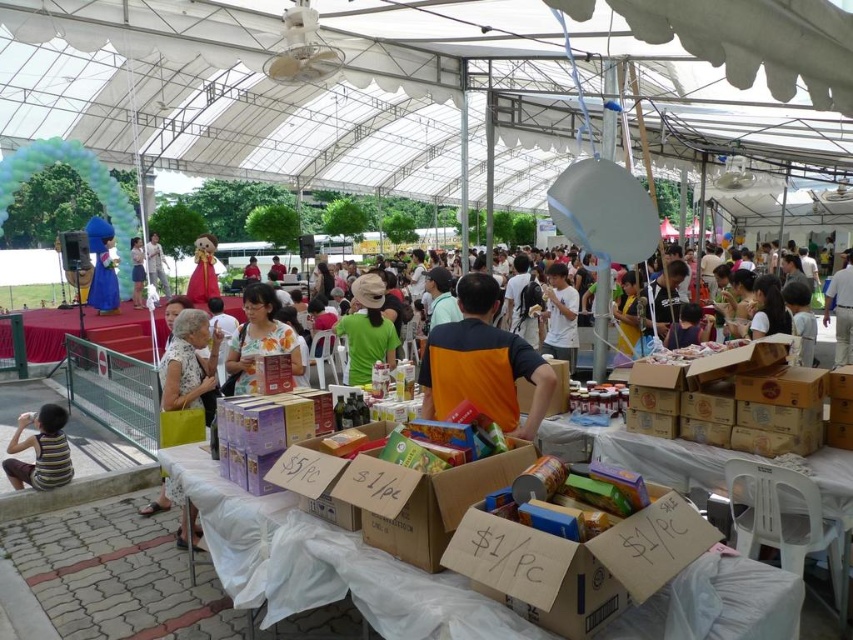
You are a customer at the market and want to buy both the white matte shirt at center and the white cotton dress at center. Which item is easier to reach without moving the other?

The white cotton dress at center is easier to reach because the white matte shirt at center is positioned under it, so you would need to move the dress to access the shirt.

You are standing at the entrance of the market and want to reach the two points marked in the scene. Which point, point (563, 317) or point (154, 241), is closer to you as you enter?

Point (563, 317) is closer to the viewer than point (154, 241).